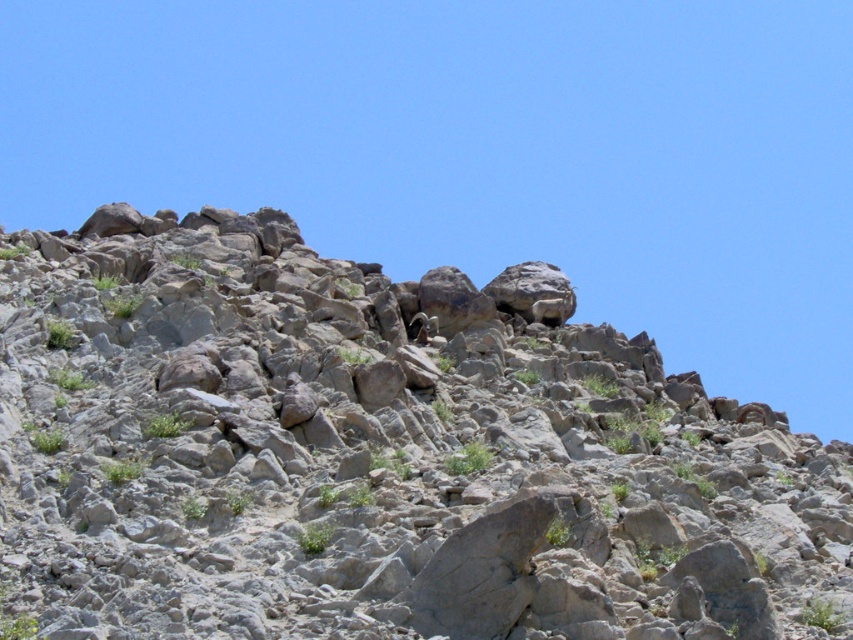
Which is behind, point (115, 508) or point (418, 332)?

Point (418, 332)

Find the location of a particular element. gray rocky mountain at upper center is located at coordinates (376, 456).

Between point (461, 468) and point (412, 337), which one is positioned behind?

The point (412, 337) is more distant.

At what (x,y) coordinates should I click in order to perform the action: click on gray rocky mountain at upper center. Please return your answer as a coordinate pair (x, y). The width and height of the screenshot is (853, 640). Looking at the image, I should click on (376, 456).